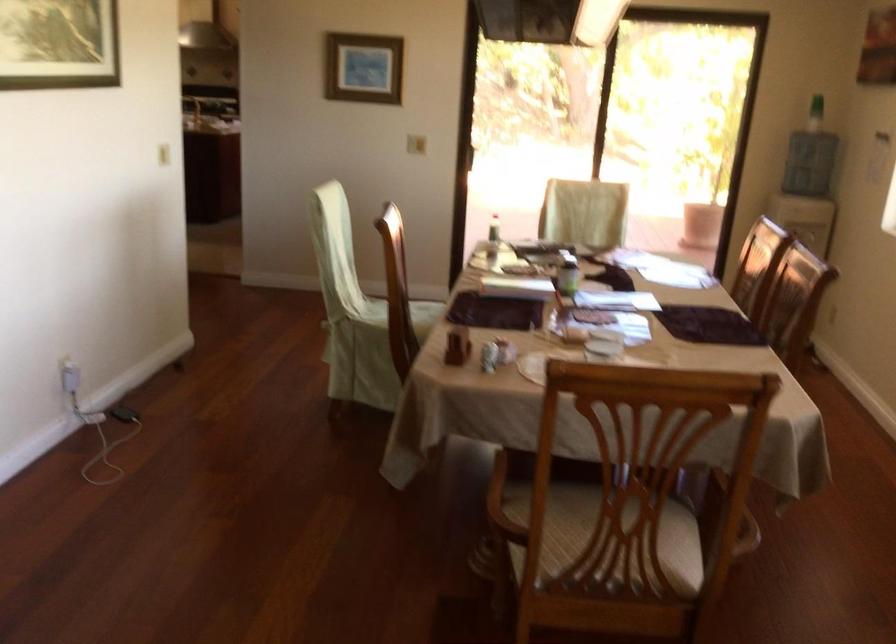
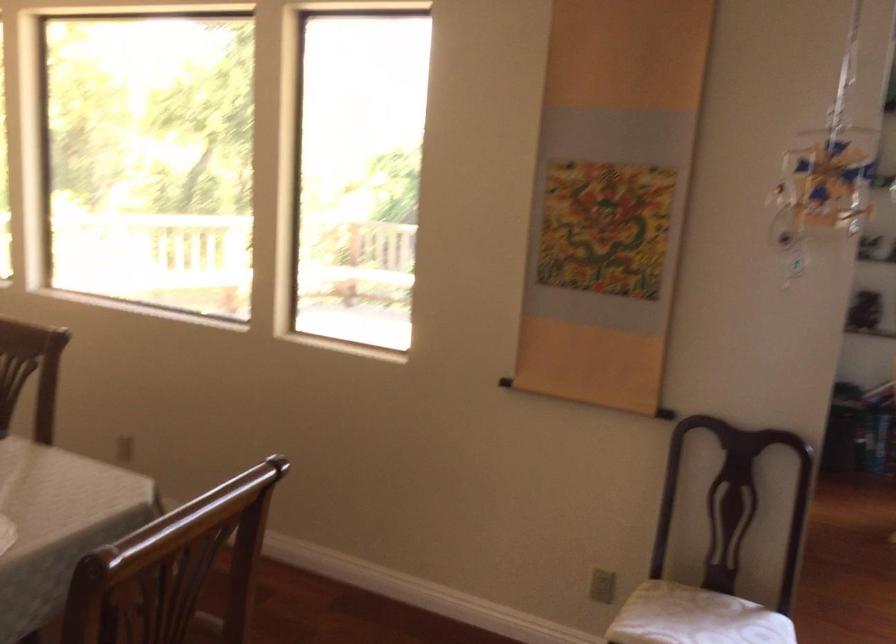
Question: The camera is either moving clockwise (left) or counter-clockwise (right) around the object. The first image is from the beginning of the video and the second image is from the end. Is the camera moving left or right when shooting the video?

Choices:
 (A) Left
 (B) Right

Answer: (A)